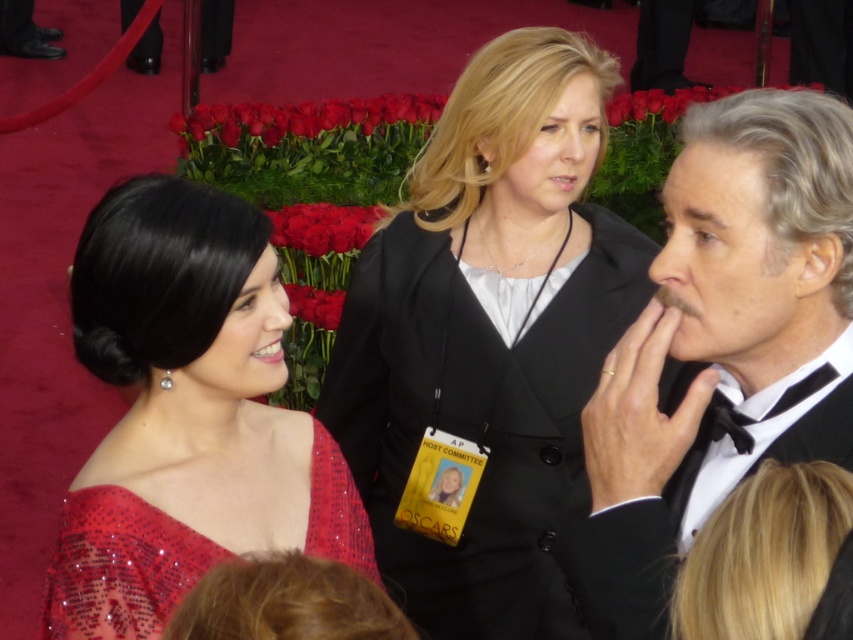
You are a photographer at the event. You need to position a spotlight on the larger of the two outfits between the black satin tuxedo at center and the satin sequined dress at lower left. Which outfit should you choose?

The black satin tuxedo at center is larger in size than the satin sequined dress at lower left, so you should position the spotlight on the black satin tuxedo at center.

You are a photographer at the event and need to position two guests wearing the black matte suit at center and the black satin tuxedo at center for a group photo. The camera requires a minimum distance of 30 inches between subjects for clarity. Can you place them at the specified distance?

The distance between the black matte suit at center and the black satin tuxedo at center is 32.42 inches, which exceeds the camera requirement of 30 inches. Therefore, they can be positioned at the specified distance.

You are standing at the center of the event venue and see two points marked on the floor, point (840, 228) and point (107, 621). Which point is closer to you?

Point (840, 228) is in front of point (107, 621), so it is closer to you.